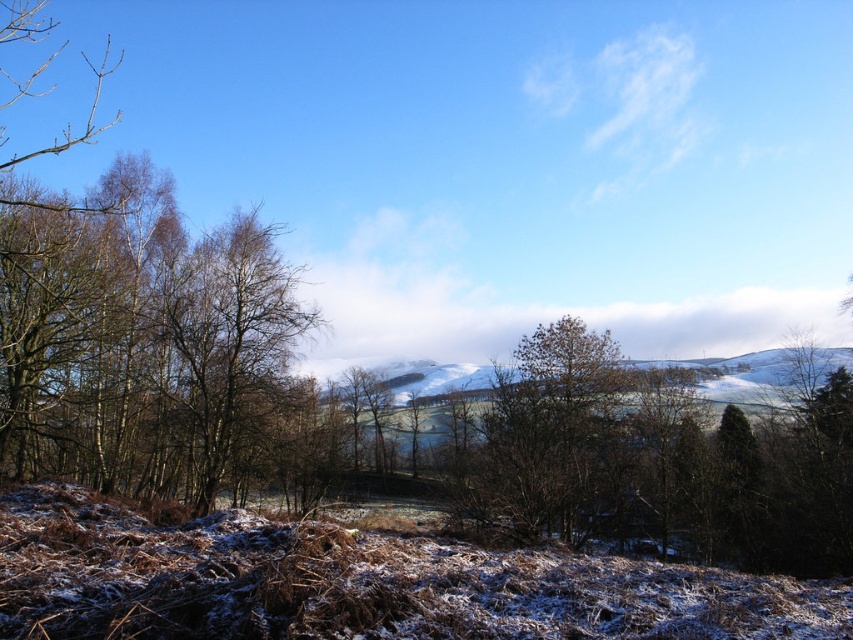
Question: Does brown bark tree at left have a larger size compared to brown textured tree at center?

Choices:
 (A) no
 (B) yes

Answer: (B)

Question: In this image, where is brown bark tree at left located relative to brown textured tree at center?

Choices:
 (A) above
 (B) below

Answer: (A)

Question: Which point appears farthest from the camera in this image?

Choices:
 (A) (115, 358)
 (B) (612, 435)

Answer: (B)

Question: Can you confirm if brown bark tree at left is positioned to the left of brown textured tree at center?

Choices:
 (A) no
 (B) yes

Answer: (B)